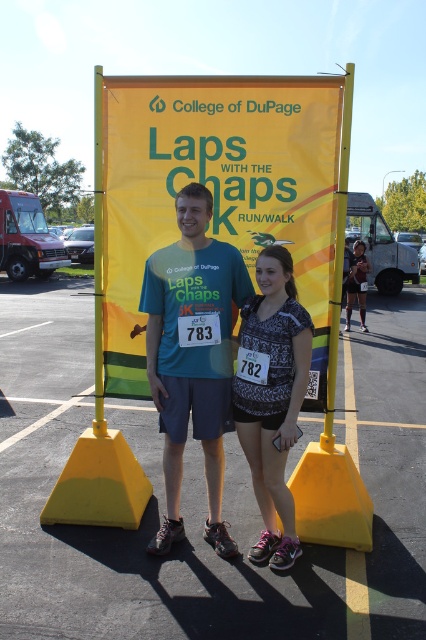
You are a photographer at the College of DuPage event and need to capture a photo where both the yellow rubber cone at center and the matte black tank top at center are clearly visible. Based on their heights, which object should you ensure is positioned closer to the camera to avoid being blocked?

The yellow rubber cone at center is shorter than the matte black tank top at center, so you should position the yellow rubber cone at center closer to the camera to prevent it from being blocked by the taller matte black tank top at center.